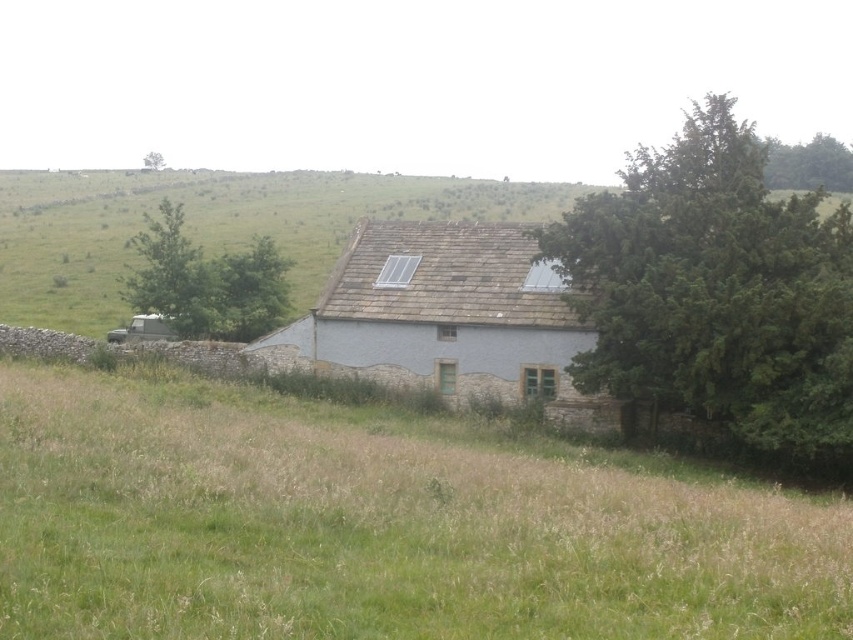
You are standing in front of the traditional stone building and want to take a photo of the green leafy tree at right and the green leafy tree at upper right. Which tree will appear closer to the camera in your photo?

The green leafy tree at right will appear closer to the camera in your photo because it is positioned in front of the green leafy tree at upper right.

Consider the image. You are planning to plant a new tree in the field near the green leafy tree at right and the green leafy tree at upper right. Based on their sizes, which tree should you choose to plant closer to the building to avoid blocking the solar panels on the roof?

The green leafy tree at right has a smaller width than the green leafy tree at upper right, so planting the smaller tree closer to the building would be better to avoid blocking the solar panels.

Based on the scene description, which object is taller between the green grass at center and the gray stone house at center?

The gray stone house at center is taller than the green grass at center according to the description.